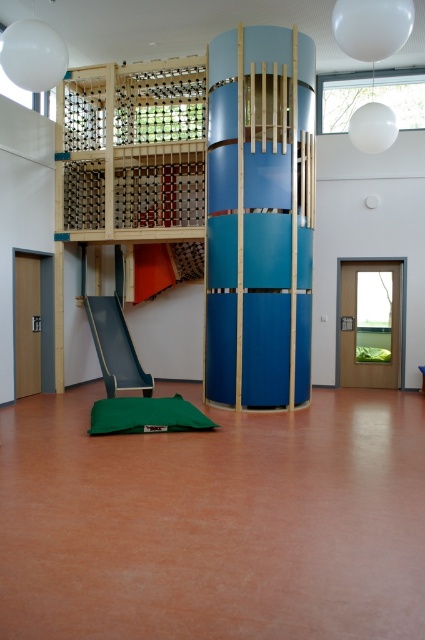
You are a child trying to decide between playing on the blue glossy pillar at center or the teal glossy slide at lower left. Which one has a wider base for standing?

The blue glossy pillar at center has a wider base for standing since its width is larger than the teal glossy slide at lower left.

You are a parent helping your child choose between two play structures in the indoor play area. The wooden bunk bed at left and the blue glossy pillar at center. Which one is shorter?

The wooden bunk bed at left is shorter than the blue glossy pillar at center.

You are a child trying to reach the wooden bunk bed at left from the blue glossy pillar at center. Which direction should you move to get there?

The wooden bunk bed at left is positioned on the right side of the blue glossy pillar at center, so you should move to your right to reach it.